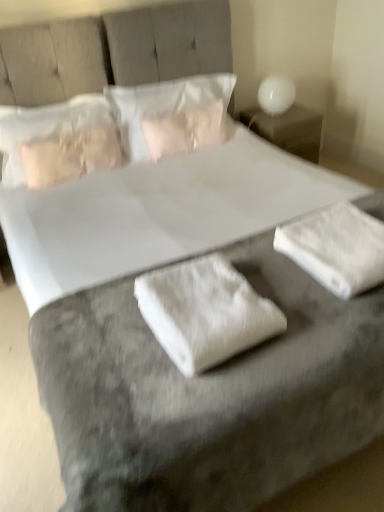
The height and width of the screenshot is (512, 384). In order to click on free space in front of white fabric at center, the second material positioned from the right in this screenshot , I will do `click(184, 397)`.